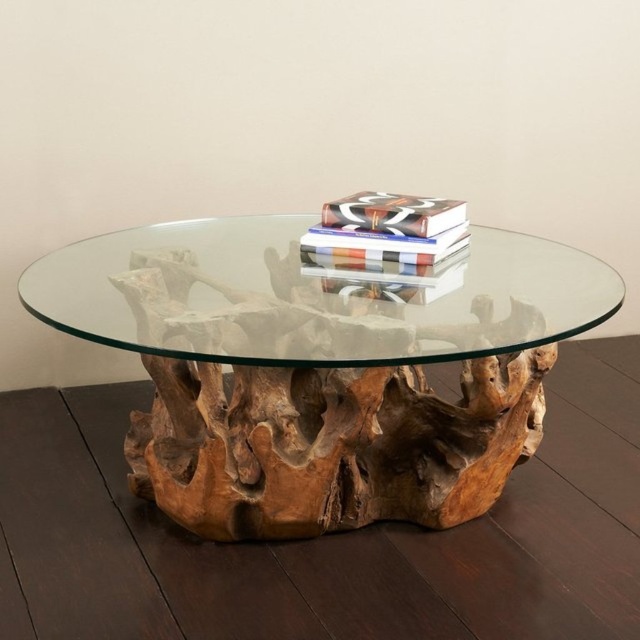
You are standing in front of the coffee table and want to place a decorative item exactly at the center of the brown wood tree trunk at center. Using a coordinate system where the bottom left corner of the table is the origin, what are the coordinates where you should place the item?

The coordinates to place the decorative item at the center of the brown wood tree trunk at center are at point (330, 444).

You are a delivery person who needs to place a package on the coffee table. The package is 24 inches long. Can you fit the package horizontally between the brown wood tree trunk at center and the matte black book at center?

The distance between the brown wood tree trunk at center and the matte black book at center is 25.16 inches. Since the package is 24 inches long, it can fit horizontally between them as there is enough space.

Based on the photo, you are trying to place a small vase between the natural wood root table at center and the transparent glass table at center. Given that the vase requires at least 0.6 inches of space to fit, will there be enough room?

The natural wood root table at center is only 0.52 inches away from the transparent glass table at center, which is less than the required 0.6 inches. Therefore, there is not enough space to place the vase between them.